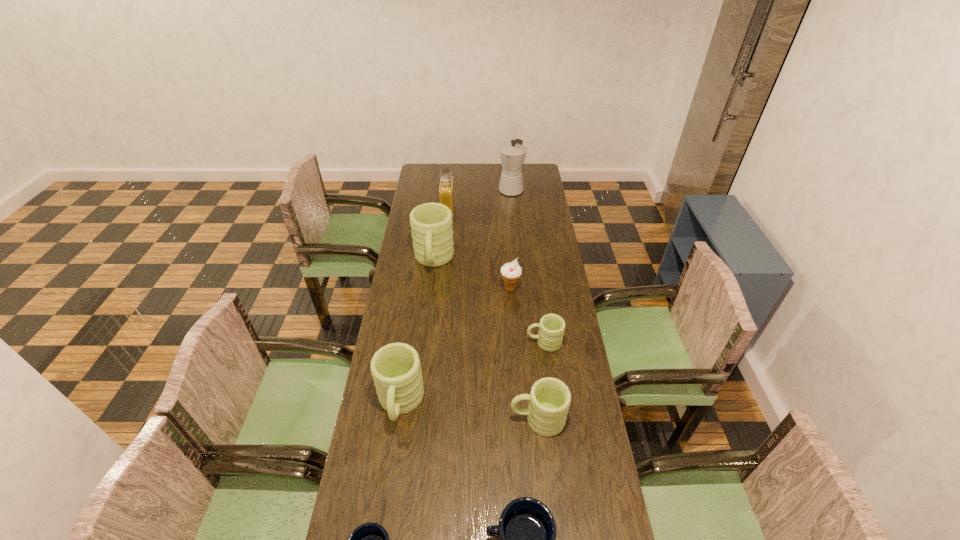
Where is `the seventh tallest object`? Image resolution: width=960 pixels, height=540 pixels. the seventh tallest object is located at coordinates (551, 328).

Locate an element on the screen. Image resolution: width=960 pixels, height=540 pixels. free space located 0.140m on the left of the tallest object is located at coordinates coord(473,189).

At what (x,y) coordinates should I click in order to perform the action: click on vacant area situated on the front-facing side of the perfume. Please return your answer as a coordinate pair (x, y). This screenshot has width=960, height=540. Looking at the image, I should click on (532, 212).

Where is `free space located 0.080m on the side of the seventh nearest object with the handle`? free space located 0.080m on the side of the seventh nearest object with the handle is located at coordinates (430, 294).

You are a GUI agent. You are given a task and a screenshot of the screen. Output one action in this format:
    pyautogui.click(x=<x>, y=<y>)
    Task: Click on the free space located on the side of the fifth shortest mug with the handle
    
    Given the screenshot: What is the action you would take?
    pyautogui.click(x=381, y=539)

Find the location of `vacant space located on the back of the sixth nearest object`. vacant space located on the back of the sixth nearest object is located at coordinates (509, 272).

Find the location of `blank space located 0.230m on the side of the third biggest green mug with the handle`. blank space located 0.230m on the side of the third biggest green mug with the handle is located at coordinates (439, 420).

This screenshot has width=960, height=540. I want to click on vacant space located 0.070m on the side of the third biggest green mug with the handle, so click(488, 420).

What are the coordinates of `vacant space situated on the side of the third biggest green mug with the handle` in the screenshot? It's located at [442, 420].

At what (x,y) coordinates should I click in order to perform the action: click on free space located 0.120m on the side of the second farthest mug with the handle. Please return your answer as a coordinate pair (x, y). The height and width of the screenshot is (540, 960). Looking at the image, I should click on (493, 343).